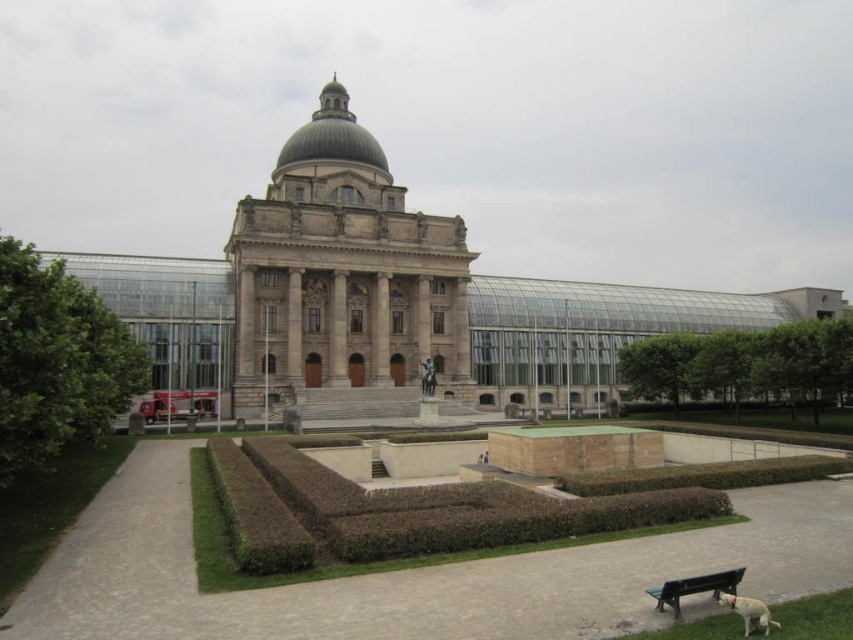
Does green leafy hedge at left lie behind green leafy hedge at right?

No.

Is green leafy hedge at left to the right of green leafy hedge at right from the viewer's perspective?

Incorrect, green leafy hedge at left is not on the right side of green leafy hedge at right.

Does point (50, 365) come behind point (828, 403)?

That is False.

Where is `green leafy hedge at left`? This screenshot has height=640, width=853. green leafy hedge at left is located at coordinates [57, 360].

Which is in front, point (836, 372) or point (746, 634)?

Positioned in front is point (746, 634).

Who is shorter, green leafy hedge at right or white fur dog at lower right?

white fur dog at lower right

Is point (746, 390) positioned in front of point (753, 625)?

No.

At what (x,y) coordinates should I click in order to perform the action: click on green leafy hedge at right. Please return your answer as a coordinate pair (x, y). The height and width of the screenshot is (640, 853). Looking at the image, I should click on (744, 365).

Based on the photo, is stone statue at center thinner than green plastic bench at lower right?

No, stone statue at center is not thinner than green plastic bench at lower right.

Who is positioned more to the right, stone statue at center or green plastic bench at lower right?

Positioned to the right is stone statue at center.

This screenshot has height=640, width=853. Find the location of `stone statue at center`. stone statue at center is located at coordinates (387, 296).